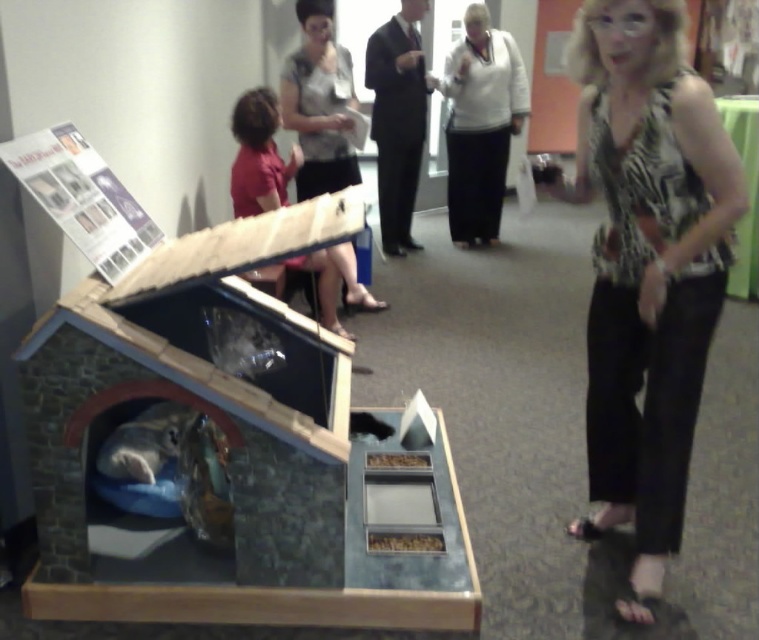
Between zebra print blouse at center and matte gray blouse at upper center, which one appears on the left side from the viewer's perspective?

matte gray blouse at upper center

Is point (688, 168) positioned in front of point (383, 305)?

Yes.

This screenshot has height=640, width=759. I want to click on zebra print blouse at center, so click(646, 266).

Looking at this image, can you confirm if white jersey at center is bigger than matte gray blouse at upper center?

Indeed, white jersey at center has a larger size compared to matte gray blouse at upper center.

Which of these two, white jersey at center or matte gray blouse at upper center, stands shorter?

matte gray blouse at upper center

Identify the location of white jersey at center. (480, 124).

Which is more to the left, zebra print blouse at center or white jersey at center?

Positioned to the left is zebra print blouse at center.

Is point (701, 336) less distant than point (509, 136)?

Yes, it is.

Locate an element on the screen. zebra print blouse at center is located at coordinates (646, 266).